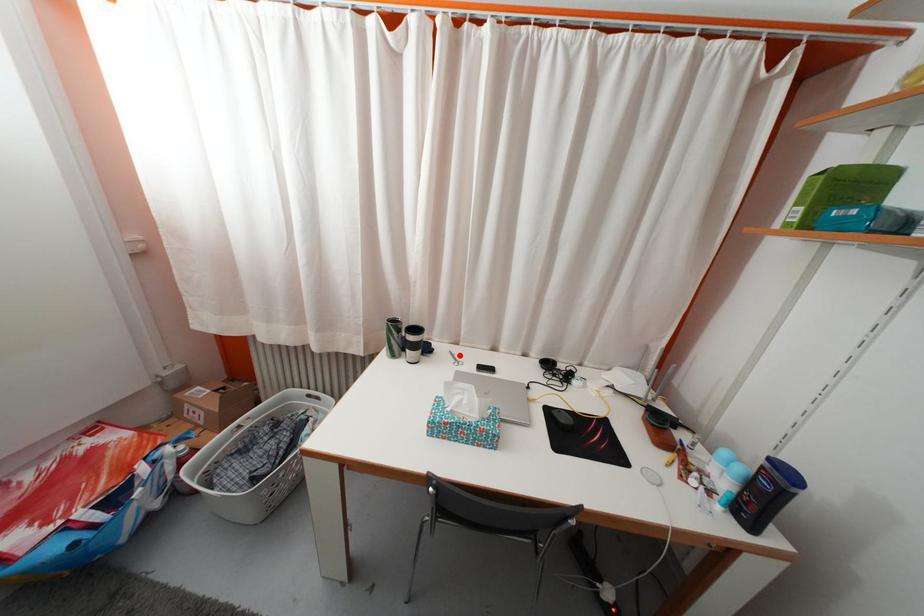
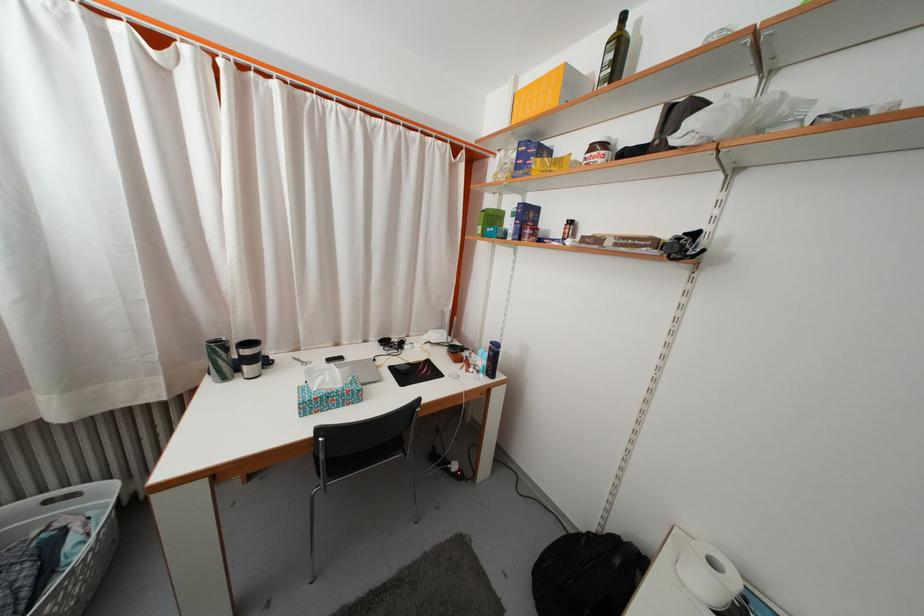
Where in the second image is the point corresponding to the highlighted location from the first image?

(301, 362)